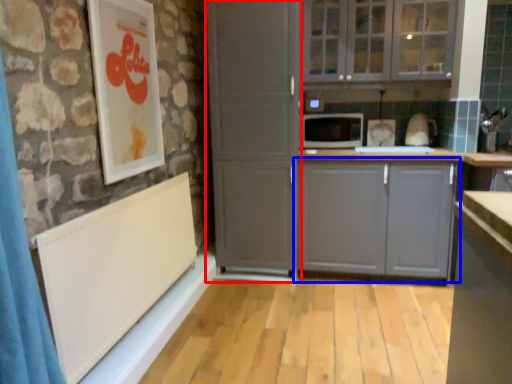
Question: Which of the following is the farthest to the observer, screen door (highlighted by a red box) or cabinetry (highlighted by a blue box)?

Choices:
 (A) screen door
 (B) cabinetry

Answer: (B)